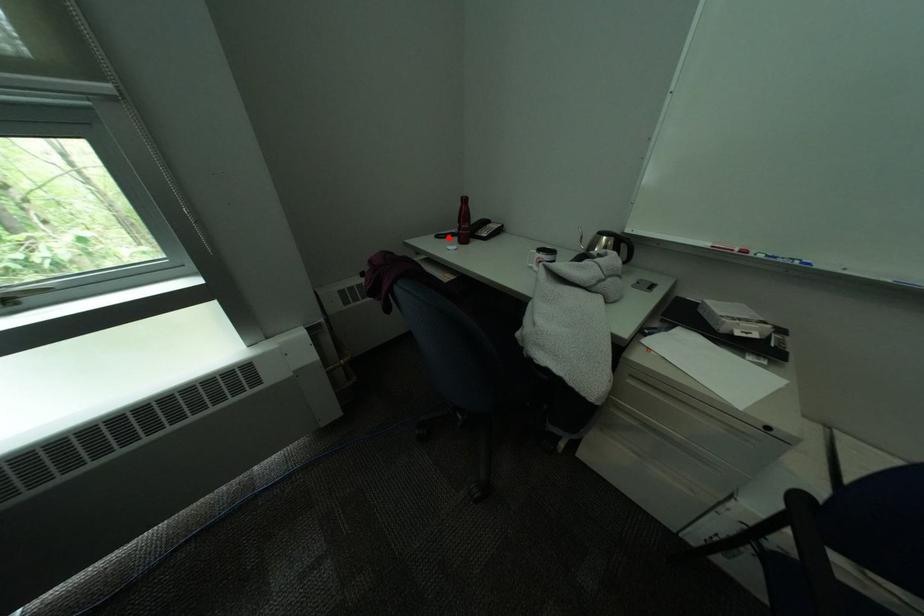
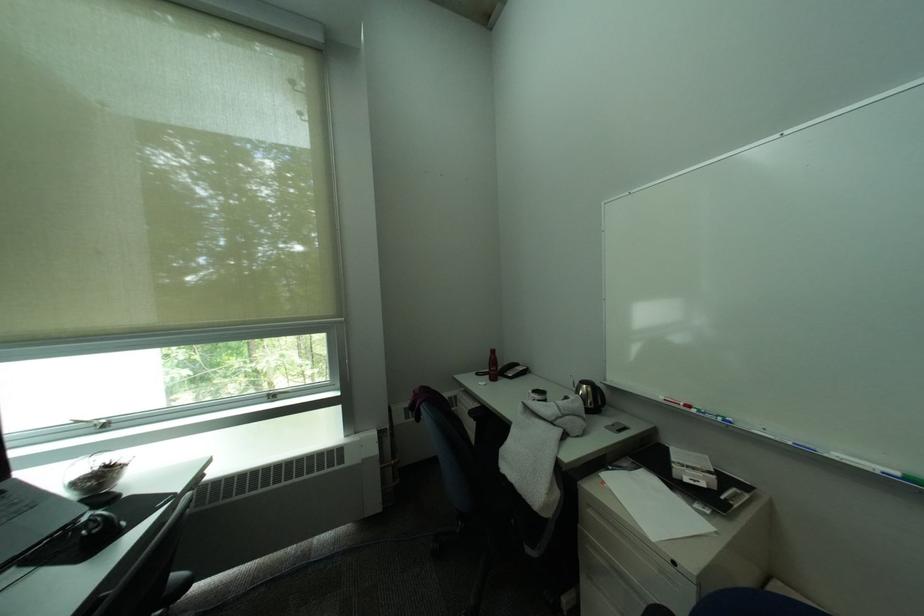
Locate, in the second image, the point that corresponds to the highlighted location in the first image.

(488, 376)